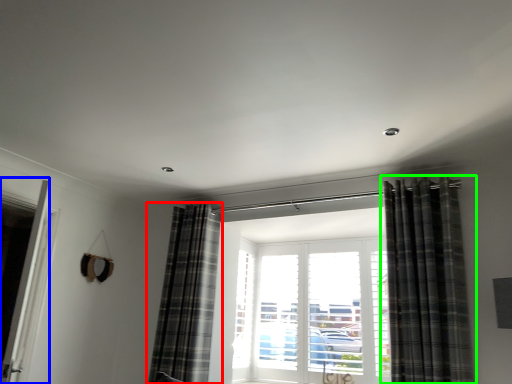
Question: Estimate the real-world distances between objects in this image. Which object is farther from curtain (highlighted by a red box), screen door (highlighted by a blue box) or curtain (highlighted by a green box)?

Choices:
 (A) screen door
 (B) curtain

Answer: (B)